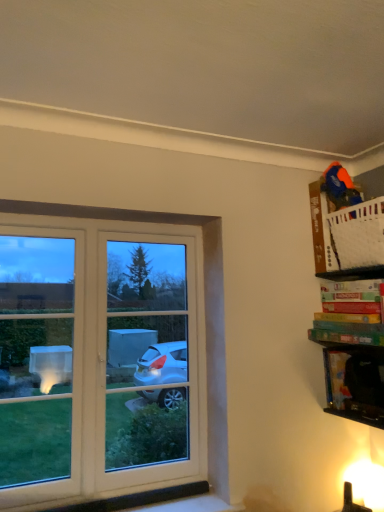
Question: From a real-world perspective, is green matte board game at upper right, the second book from the top, physically located above or below multicolored cardboard game at upper right, positioned as the second book in bottom-to-top order?

Choices:
 (A) below
 (B) above

Answer: (A)

Question: Is green matte board game at upper right, the second book from the top, wider or thinner than multicolored cardboard game at upper right, placed as the first book when sorted from top to bottom?

Choices:
 (A) thin
 (B) wide

Answer: (B)

Question: Which is farther from the green matte board game at upper right, the second book from the top?

Choices:
 (A) black plastic cabinet at lower right
 (B) multicolored cardboard game at upper right, positioned as the second book in bottom-to-top order

Answer: (A)

Question: Considering the real-world distances, which object is farthest from the green matte board game at upper right, the second book from the top?

Choices:
 (A) multicolored cardboard game at upper right, placed as the first book when sorted from top to bottom
 (B) black plastic cabinet at lower right

Answer: (B)